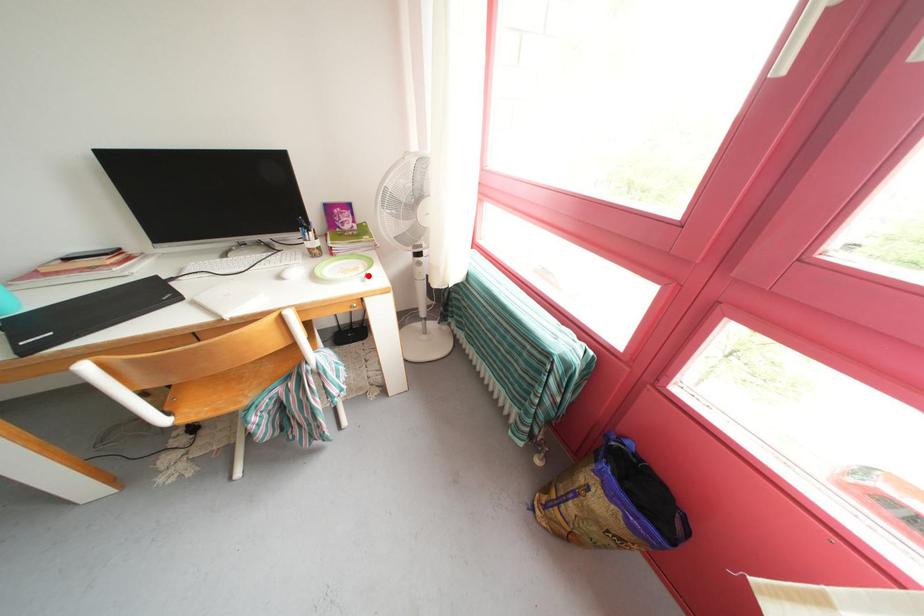
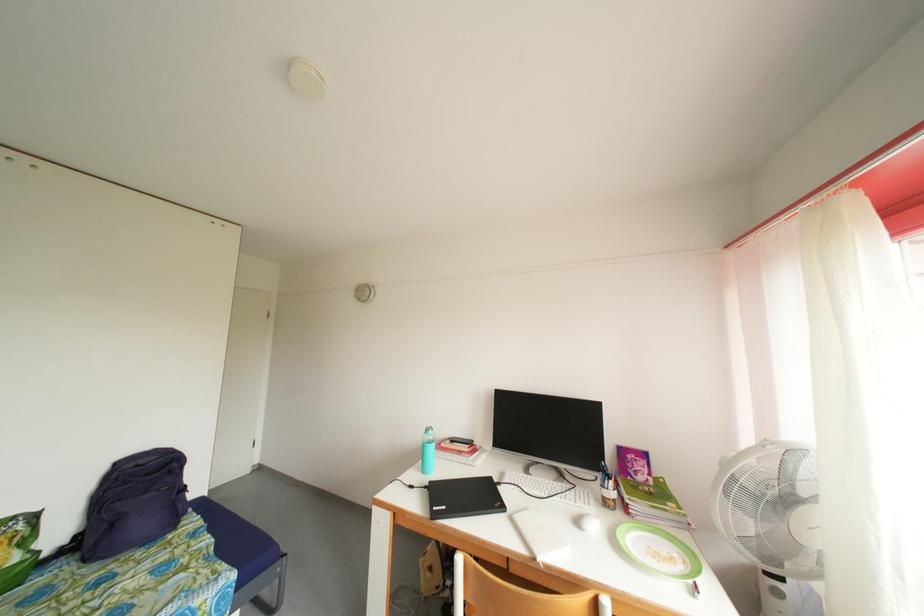
Question: I am providing you with two images of the same scene from different viewpoints. A red point is marked on the first image. Can you still see the location of the red point in image 2?

Choices:
 (A) Yes
 (B) No

Answer: (A)